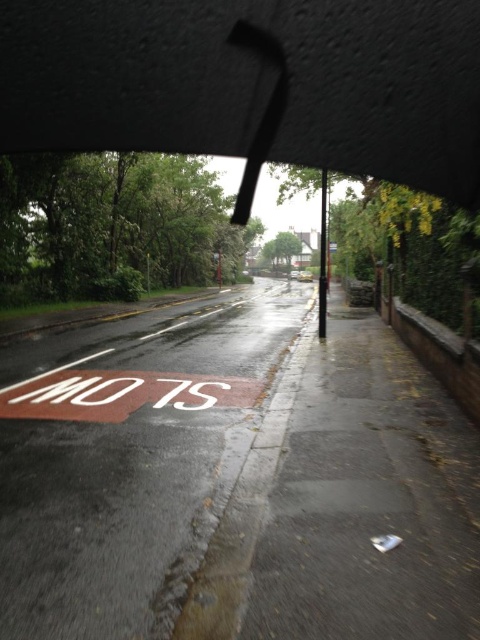
Is transparent plastic umbrella at upper center bigger than metallic silver car at center?

Actually, transparent plastic umbrella at upper center might be smaller than metallic silver car at center.

Does point (95, 33) come behind point (290, 276)?

No, it is in front of (290, 276).

At what (x,y) coordinates should I click in order to perform the action: click on transparent plastic umbrella at upper center. Please return your answer as a coordinate pair (x, y). The width and height of the screenshot is (480, 640). Looking at the image, I should click on (252, 83).

Is transparent plastic umbrella at upper center to the right of yellow matte car at center from the viewer's perspective?

No, transparent plastic umbrella at upper center is not to the right of yellow matte car at center.

Does transparent plastic umbrella at upper center have a lesser width compared to yellow matte car at center?

Correct, transparent plastic umbrella at upper center's width is less than yellow matte car at center's.

Between point (44, 122) and point (307, 278), which one is positioned behind?

The point (307, 278) is more distant.

Identify the location of transparent plastic umbrella at upper center. This screenshot has height=640, width=480. (252, 83).

Is point (310, 280) more distant than point (298, 273)?

No.

Which of these two, yellow matte car at center or metallic silver car at center, stands shorter?

Standing shorter between the two is metallic silver car at center.

Is point (303, 280) positioned behind point (299, 273)?

That is False.

Image resolution: width=480 pixels, height=640 pixels. I want to click on yellow matte car at center, so 304,275.